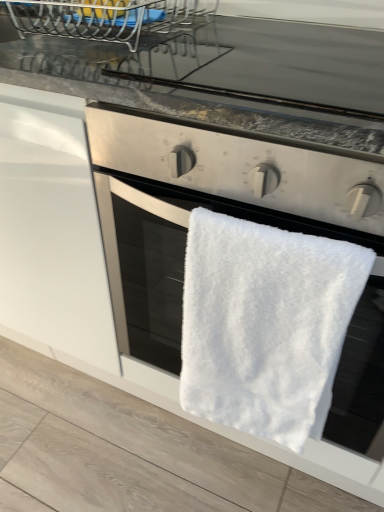
Identify the location of black glass at upper center. The width and height of the screenshot is (384, 512). (227, 78).

The width and height of the screenshot is (384, 512). Describe the element at coordinates (227, 78) in the screenshot. I see `black glass at upper center` at that location.

What is the approximate height of black glass at upper center?

It is 1.81 inches.

This screenshot has height=512, width=384. Describe the element at coordinates (265, 325) in the screenshot. I see `white fluffy towel at center` at that location.

Locate an element on the screen. This screenshot has width=384, height=512. white fluffy towel at center is located at coordinates (265, 325).

What is the approximate width of white fluffy towel at center?

It is 4.38 inches.

Where is `black glass at upper center`? black glass at upper center is located at coordinates (227, 78).

Considering the positions of objects white fluffy towel at center and black glass at upper center in the image provided, who is more to the left, white fluffy towel at center or black glass at upper center?

From the viewer's perspective, white fluffy towel at center appears more on the left side.

Considering the positions of objects white fluffy towel at center and black glass at upper center in the image provided, who is in front, white fluffy towel at center or black glass at upper center?

Positioned in front is white fluffy towel at center.

Is point (307, 241) closer or farther from the camera than point (146, 85)?

Point (307, 241) is positioned closer to the camera compared to point (146, 85).

From the image's perspective, between white fluffy towel at center and black glass at upper center, who is located below?

white fluffy towel at center appears lower in the image.

From a real-world perspective, is white fluffy towel at center physically below black glass at upper center?

Correct, in the physical world, white fluffy towel at center is lower than black glass at upper center.

Which of these two, white fluffy towel at center or black glass at upper center, is thinner?

white fluffy towel at center is thinner.

Who is taller, white fluffy towel at center or black glass at upper center?

With more height is white fluffy towel at center.

Is white fluffy towel at center bigger or smaller than black glass at upper center?

In the image, white fluffy towel at center appears to be larger than black glass at upper center.

Is black glass at upper center completely or partially inside white fluffy towel at center?

Actually, black glass at upper center is outside white fluffy towel at center.

Is white fluffy towel at center not near black glass at upper center?

That's not correct — white fluffy towel at center is a little close to black glass at upper center.

Is white fluffy towel at center facing away from black glass at upper center?

Yes, white fluffy towel at center's orientation is away from black glass at upper center.

What's the angular difference between white fluffy towel at center and black glass at upper center's facing directions?

They differ by 0.634 degrees in their facing directions.

Find the location of `towel/napkin that appears below the black glass at upper center (from the image's perspective)`. towel/napkin that appears below the black glass at upper center (from the image's perspective) is located at coordinates (265, 325).

Considering the positions of objects black glass at upper center and white fluffy towel at center in the image provided, who is more to the left, black glass at upper center or white fluffy towel at center?

From the viewer's perspective, white fluffy towel at center appears more on the left side.

Between black glass at upper center and white fluffy towel at center, which one is positioned behind?

Positioned behind is black glass at upper center.

Does point (282, 34) come behind point (254, 277)?

Yes, it is behind point (254, 277).

From the image's perspective, does black glass at upper center appear lower than white fluffy towel at center?

Incorrect, from the image's perspective, black glass at upper center is higher than white fluffy towel at center.

From a real-world perspective, does black glass at upper center sit lower than white fluffy towel at center?

No, from a real-world perspective, black glass at upper center is not below white fluffy towel at center.

Considering the relative sizes of black glass at upper center and white fluffy towel at center in the image provided, is black glass at upper center thinner than white fluffy towel at center?

No, black glass at upper center is not thinner than white fluffy towel at center.

Can you confirm if black glass at upper center is shorter than white fluffy towel at center?

Indeed, black glass at upper center has a lesser height compared to white fluffy towel at center.

Considering the sizes of objects black glass at upper center and white fluffy towel at center in the image provided, who is bigger, black glass at upper center or white fluffy towel at center?

white fluffy towel at center is bigger.

Is black glass at upper center located outside white fluffy towel at center?

Yes, black glass at upper center is outside of white fluffy towel at center.

Is black glass at upper center next to white fluffy towel at center?

No, black glass at upper center is not in contact with white fluffy towel at center.

Is black glass at upper center facing towards white fluffy towel at center?

No, black glass at upper center does not turn towards white fluffy towel at center.

How different are the orientations of black glass at upper center and white fluffy towel at center in degrees?

0.634 degrees separate the facing orientations of black glass at upper center and white fluffy towel at center.

What are the coordinates of `towel/napkin below the black glass at upper center (from the image's perspective)` in the screenshot? It's located at (265, 325).

Where is `countertop above the white fluffy towel at center (from a real-world perspective)`? The width and height of the screenshot is (384, 512). countertop above the white fluffy towel at center (from a real-world perspective) is located at coordinates (227, 78).

Where is `towel/napkin that appears below the black glass at upper center (from a real-world perspective)`? This screenshot has width=384, height=512. towel/napkin that appears below the black glass at upper center (from a real-world perspective) is located at coordinates (265, 325).